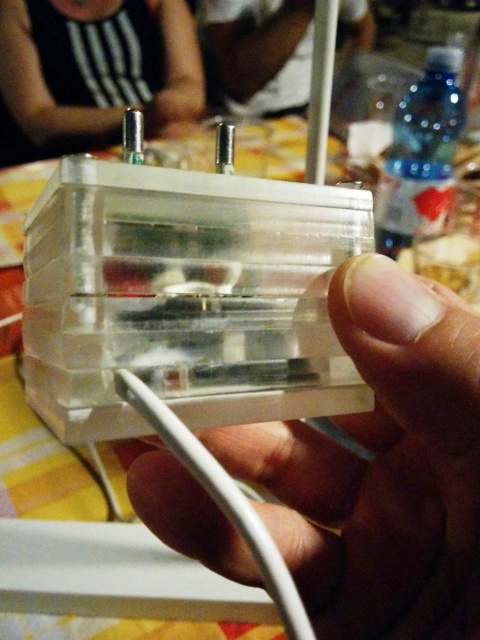
Who is lower down, black striped tank top at upper left or white shirt at upper center?

black striped tank top at upper left is below.

Image resolution: width=480 pixels, height=640 pixels. What do you see at coordinates (95, 68) in the screenshot? I see `black striped tank top at upper left` at bounding box center [95, 68].

Where is `black striped tank top at upper left`? The image size is (480, 640). black striped tank top at upper left is located at coordinates (95, 68).

Can you confirm if transparent plastic hand at center is positioned to the right of white shirt at upper center?

No, transparent plastic hand at center is not to the right of white shirt at upper center.

Who is positioned more to the right, transparent plastic hand at center or white shirt at upper center?

Positioned to the right is white shirt at upper center.

Describe the element at coordinates (382, 467) in the screenshot. This screenshot has height=640, width=480. I see `transparent plastic hand at center` at that location.

Where is `transparent plastic hand at center`? The image size is (480, 640). transparent plastic hand at center is located at coordinates (382, 467).

In the scene shown: Measure the distance from transparent plastic hand at center to black striped tank top at upper left.

transparent plastic hand at center and black striped tank top at upper left are 5.19 feet apart.

Can you confirm if transparent plastic hand at center is shorter than black striped tank top at upper left?

Yes, transparent plastic hand at center is shorter than black striped tank top at upper left.

Image resolution: width=480 pixels, height=640 pixels. What are the coordinates of `transparent plastic hand at center` in the screenshot? It's located at (382, 467).